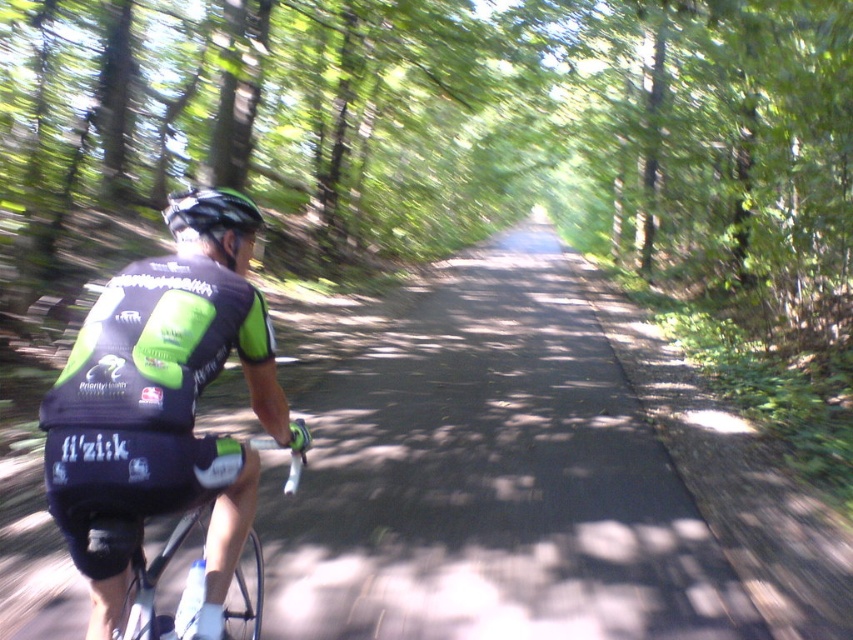
Question: Can you confirm if black matte cycling jersey at left is positioned to the left of matte black helmet at center?

Choices:
 (A) yes
 (B) no

Answer: (B)

Question: Which of the following is the closest to the observer?

Choices:
 (A) black matte cycling jersey at left
 (B) matte black helmet at center

Answer: (A)

Question: Does black matte cycling jersey at left appear under matte black helmet at center?

Choices:
 (A) no
 (B) yes

Answer: (B)

Question: Does black matte cycling jersey at left lie in front of matte black helmet at center?

Choices:
 (A) yes
 (B) no

Answer: (A)